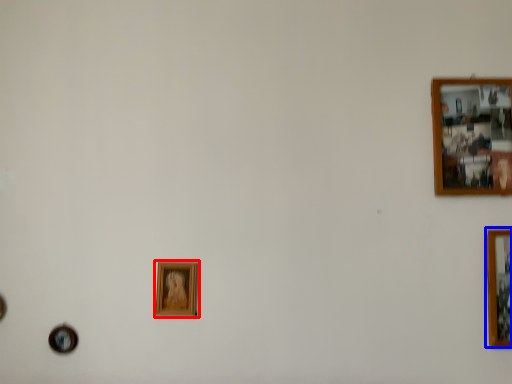
Question: Among these objects, which one is farthest to the camera, picture frame (highlighted by a red box) or picture frame (highlighted by a blue box)?

Choices:
 (A) picture frame
 (B) picture frame

Answer: (A)